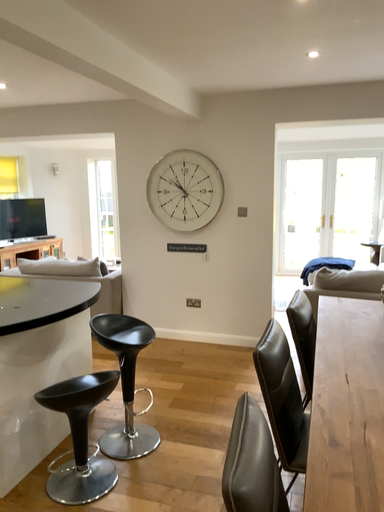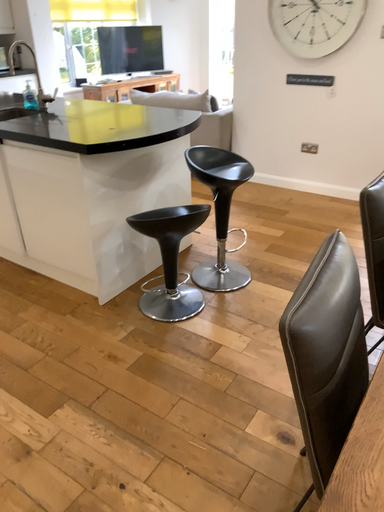
Question: How did the camera likely rotate when shooting the video?

Choices:
 (A) rotated right
 (B) rotated left

Answer: (B)